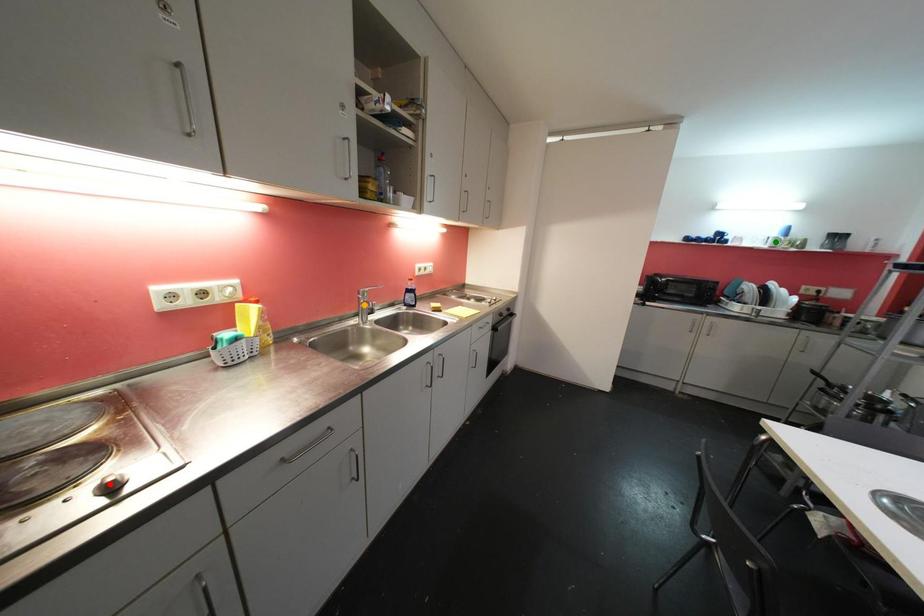
Order these from nearest to farthest:
- green point
- red point
- orange point

green point
orange point
red point